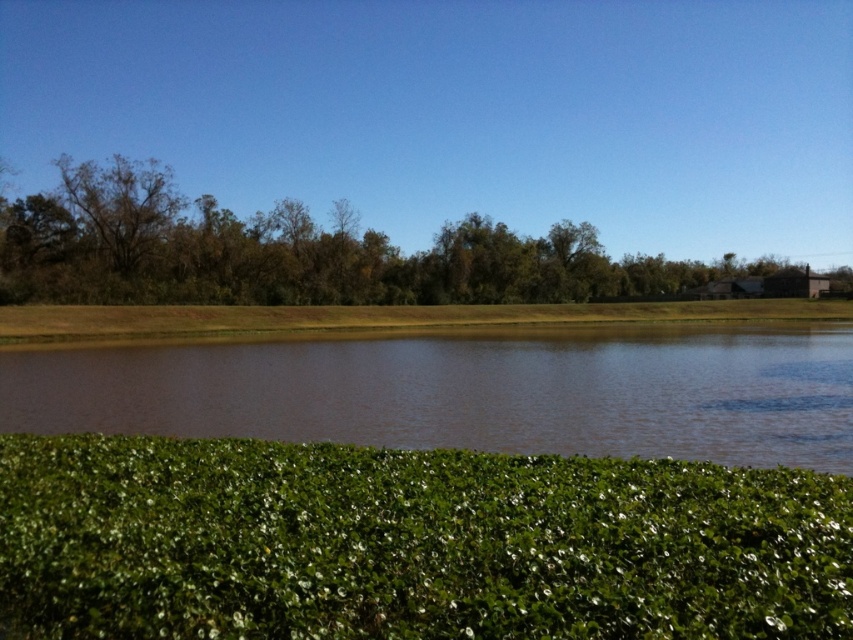
Question: Which point appears farthest from the camera in this image?

Choices:
 (A) (199, 424)
 (B) (115, 272)

Answer: (B)

Question: From the image, what is the correct spatial relationship of green leafy plant at lower center in relation to brown textured tree at upper left?

Choices:
 (A) left
 (B) right

Answer: (B)

Question: Which object is closer to the camera taking this photo?

Choices:
 (A) green leafy plant at lower center
 (B) brown textured tree at upper left
 (C) brown water at center

Answer: (A)

Question: Does brown water at center appear on the left side of brown textured tree at upper left?

Choices:
 (A) yes
 (B) no

Answer: (B)

Question: Does brown water at center appear under brown textured tree at upper left?

Choices:
 (A) yes
 (B) no

Answer: (A)

Question: Estimate the real-world distances between objects in this image. Which object is farther from the brown water at center?

Choices:
 (A) green leafy plant at lower center
 (B) green leafy trees at upper center
 (C) brown textured tree at upper left

Answer: (B)